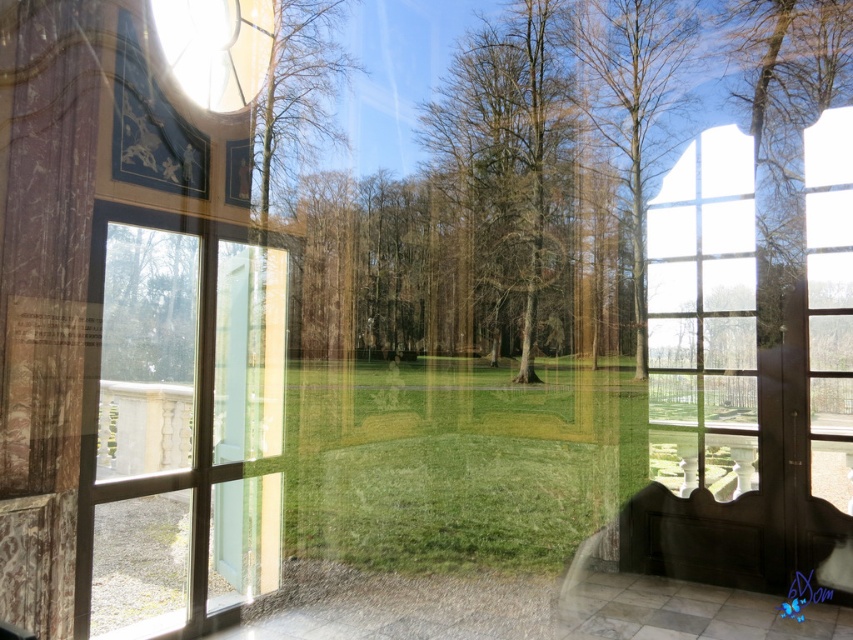
Is point (741, 148) positioned before point (613, 8)?

Yes.

Is point (650, 412) more distant than point (633, 58)?

No, it is not.

Who is more forward, (715,344) or (637,138)?

Point (715,344)

Where is `clear glass window at center`? clear glass window at center is located at coordinates (703, 317).

Is clear glass door at left thinner than green leafy tree at center?

No.

This screenshot has width=853, height=640. Describe the element at coordinates (178, 420) in the screenshot. I see `clear glass door at left` at that location.

Where is `clear glass door at left`? The image size is (853, 640). clear glass door at left is located at coordinates (178, 420).

Which of these two, clear glass door at left or clear glass window at center, stands shorter?

With less height is clear glass door at left.

Between point (107, 205) and point (651, 317), which one is positioned behind?

Point (651, 317)

Locate an element on the screen. This screenshot has height=640, width=853. clear glass door at left is located at coordinates (178, 420).